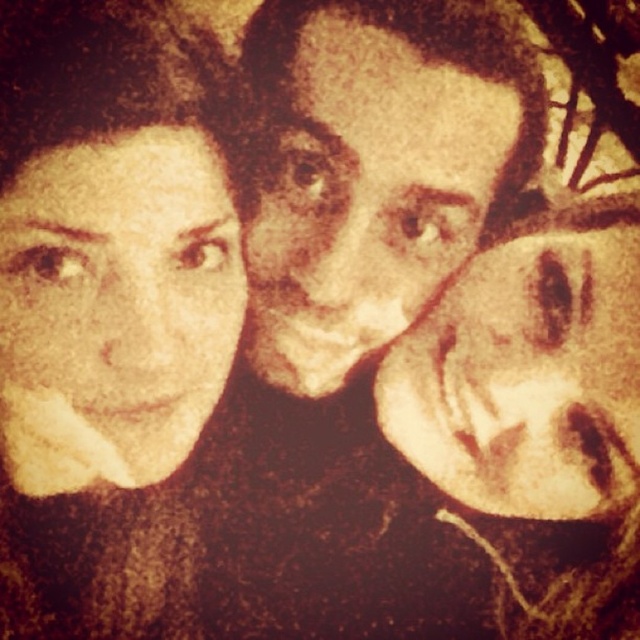
Question: Which of the following is the closest to the observer?

Choices:
 (A) (515, 385)
 (B) (392, 182)
 (C) (22, 339)

Answer: (C)

Question: Which of the following is the closest to the observer?

Choices:
 (A) smooth beige face at right
 (B) brown matte face at center
 (C) matte yellow face at left

Answer: (C)

Question: Which object appears farthest from the camera in this image?

Choices:
 (A) brown matte face at center
 (B) matte yellow face at left

Answer: (A)

Question: Does matte yellow face at left appear on the right side of brown matte face at center?

Choices:
 (A) no
 (B) yes

Answer: (A)

Question: From the image, what is the correct spatial relationship of brown matte face at center in relation to smooth beige face at right?

Choices:
 (A) right
 (B) left

Answer: (B)

Question: Is matte yellow face at left above brown matte face at center?

Choices:
 (A) no
 (B) yes

Answer: (A)